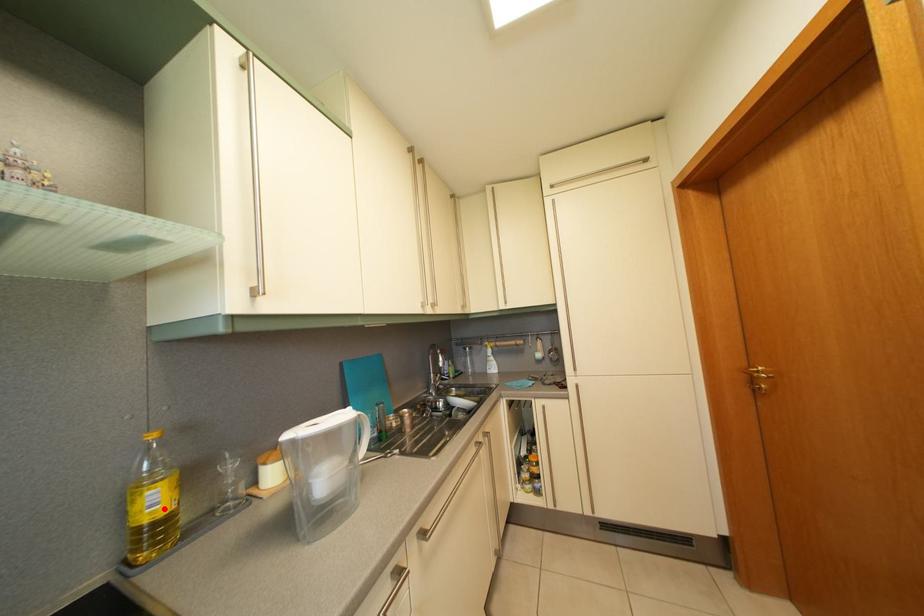
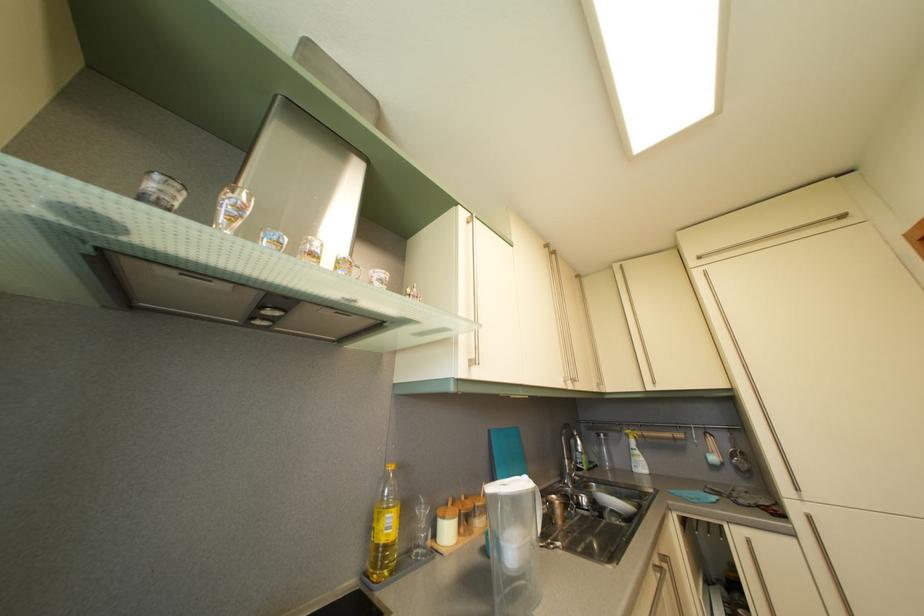
Locate, in the second image, the point that corresponds to the highlighted location in the first image.

(396, 533)